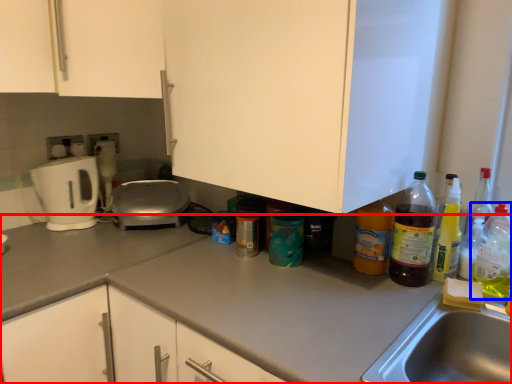
Question: Which object is closer to the camera taking this photo, countertop (highlighted by a red box) or bottle (highlighted by a blue box)?

Choices:
 (A) countertop
 (B) bottle

Answer: (A)